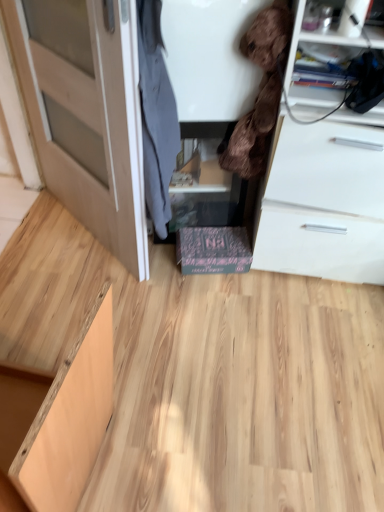
Identify the location of vacant location behind light wood cabinet at lower left, acting as the first cabinetry starting from the front. This screenshot has width=384, height=512. (119, 333).